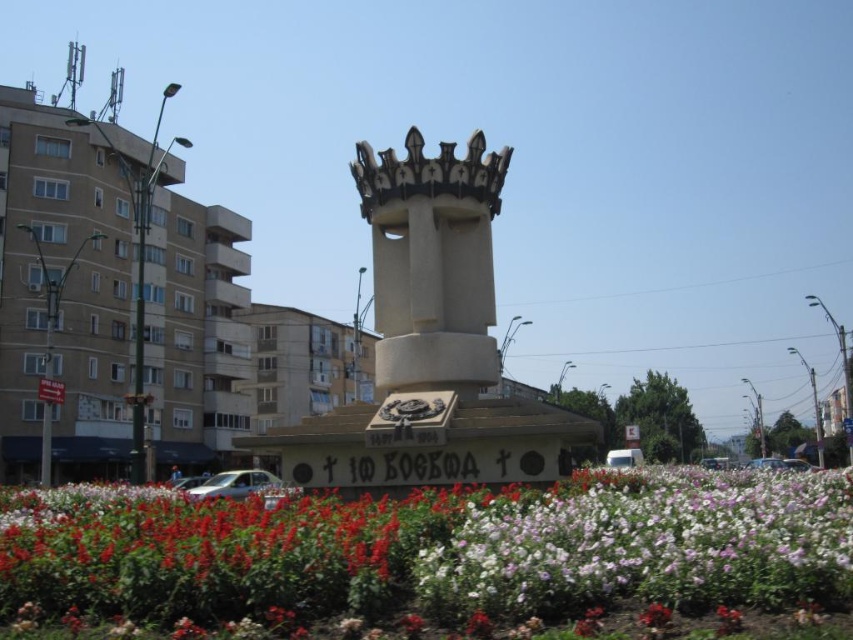
Can you confirm if white matte flowers at center is positioned to the left of silver metallic car at lower center?

In fact, white matte flowers at center is to the right of silver metallic car at lower center.

Does white matte flowers at center have a greater width compared to silver metallic car at lower center?

Correct, the width of white matte flowers at center exceeds that of silver metallic car at lower center.

Between point (770, 538) and point (219, 492), which one is positioned in front?

Point (770, 538)

Find the location of a particular element. The width and height of the screenshot is (853, 640). white matte flowers at center is located at coordinates (440, 548).

This screenshot has width=853, height=640. What do you see at coordinates (440, 548) in the screenshot?
I see `white matte flowers at center` at bounding box center [440, 548].

Who is positioned more to the right, white matte flowers at center or white stone tower at center?

white matte flowers at center

You are a GUI agent. You are given a task and a screenshot of the screen. Output one action in this format:
    pyautogui.click(x=<x>, y=<y>)
    Task: Click on the white matte flowers at center
    
    Given the screenshot: What is the action you would take?
    pos(440,548)

How far apart are stone monument at center and silver metallic car at lower center?

A distance of 14.45 meters exists between stone monument at center and silver metallic car at lower center.

Can you confirm if stone monument at center is shorter than silver metallic car at lower center?

Incorrect, stone monument at center's height does not fall short of silver metallic car at lower center's.

Image resolution: width=853 pixels, height=640 pixels. What do you see at coordinates (430, 342) in the screenshot?
I see `stone monument at center` at bounding box center [430, 342].

You are a GUI agent. You are given a task and a screenshot of the screen. Output one action in this format:
    pyautogui.click(x=<x>, y=<y>)
    Task: Click on the stone monument at center
    This screenshot has height=640, width=853.
    Given the screenshot: What is the action you would take?
    pyautogui.click(x=430, y=342)